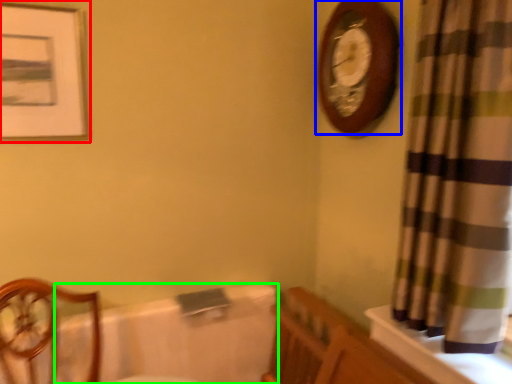
Question: Considering the real-world distances, which object is farthest from picture frame (highlighted by a red box)? wall clock (highlighted by a blue box) or bath (highlighted by a green box)?

Choices:
 (A) wall clock
 (B) bath

Answer: (A)